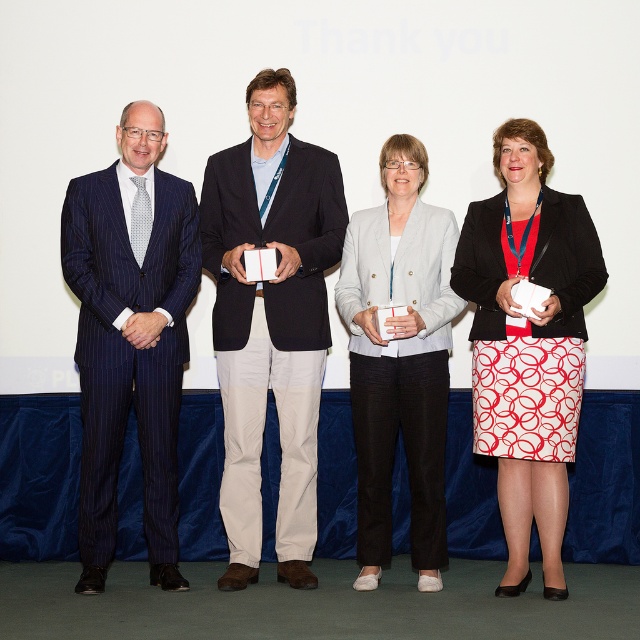
Question: Can you confirm if matte black suit at center is positioned above light gray blazer at center?

Choices:
 (A) no
 (B) yes

Answer: (B)

Question: Observing the image, what is the correct spatial positioning of matte black suit at center in reference to white printed skirt at center?

Choices:
 (A) below
 (B) above

Answer: (B)

Question: Which of the following is the closest to the observer?

Choices:
 (A) light gray blazer at center
 (B) white printed skirt at center
 (C) blue pinstripe suit at left

Answer: (B)

Question: Does white printed skirt at center appear on the left side of light gray blazer at center?

Choices:
 (A) no
 (B) yes

Answer: (A)

Question: Which point is closer to the camera?

Choices:
 (A) coord(508,497)
 (B) coord(96,435)
 (C) coord(440,355)

Answer: (B)

Question: Among these objects, which one is farthest from the camera?

Choices:
 (A) blue pinstripe suit at left
 (B) matte black suit at center
 (C) light gray blazer at center

Answer: (B)